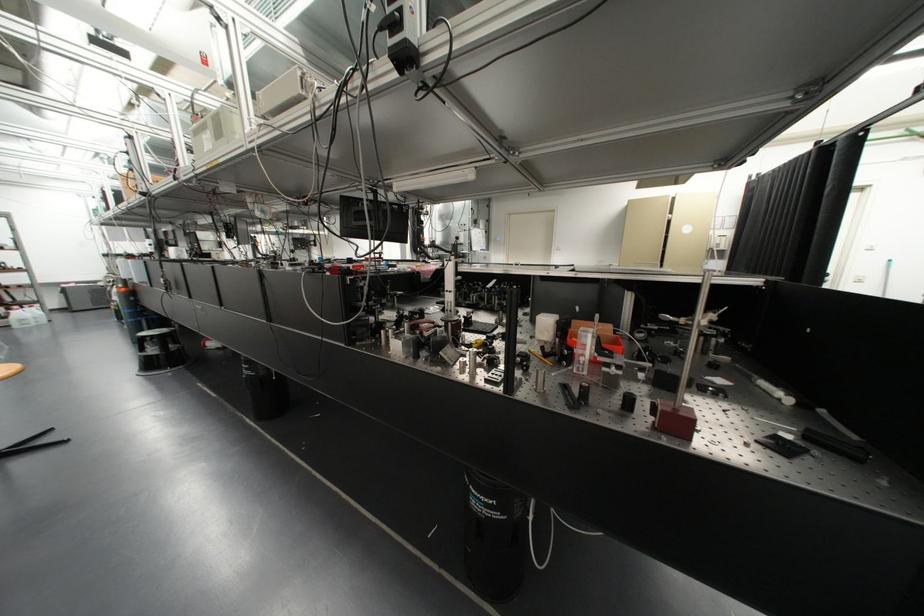
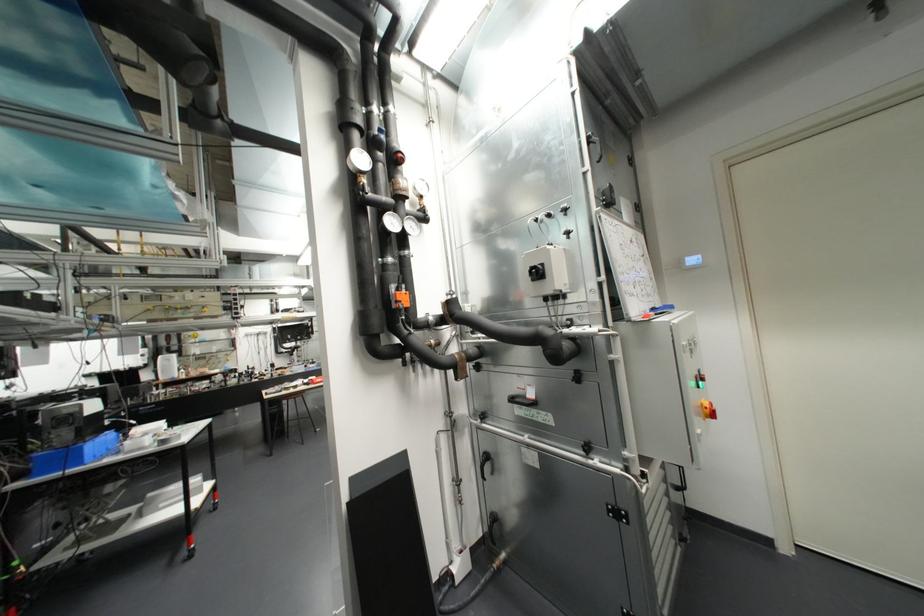
Locate, in the second image, the point that corresponds to point (456, 238) in the first image.

(537, 273)